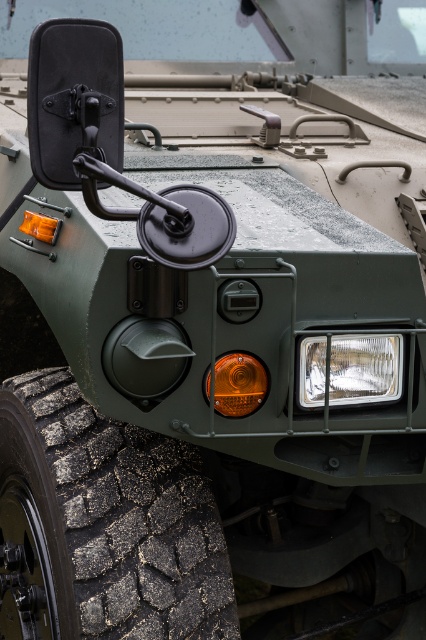
You are a mechanic inspecting the front left side of a military vehicle. You need to compare the width of the black rubber tire at lower left and the clear plastic headlight at lower right. Which object has a greater width?

The black rubber tire at lower left has a greater width than the clear plastic headlight at lower right.

You are a soldier who needs to check the tire pressure of the black rubber tire at lower left. The point marked at coordinate (103, 524) is located on which part of the black rubber tire at lower left?

The point marked at coordinate (103, 524) corresponds to the black rubber tire at lower left, as stated in the objects description.

You are a military technician inspecting the front left side of a Humvee. You notice two points marked on the vehicle at coordinates point (221, 566) and point (360, 397). Which point is closer to you as you face the vehicle?

Point (221, 566) is closer to you because it is further to the viewer than point (360, 397).